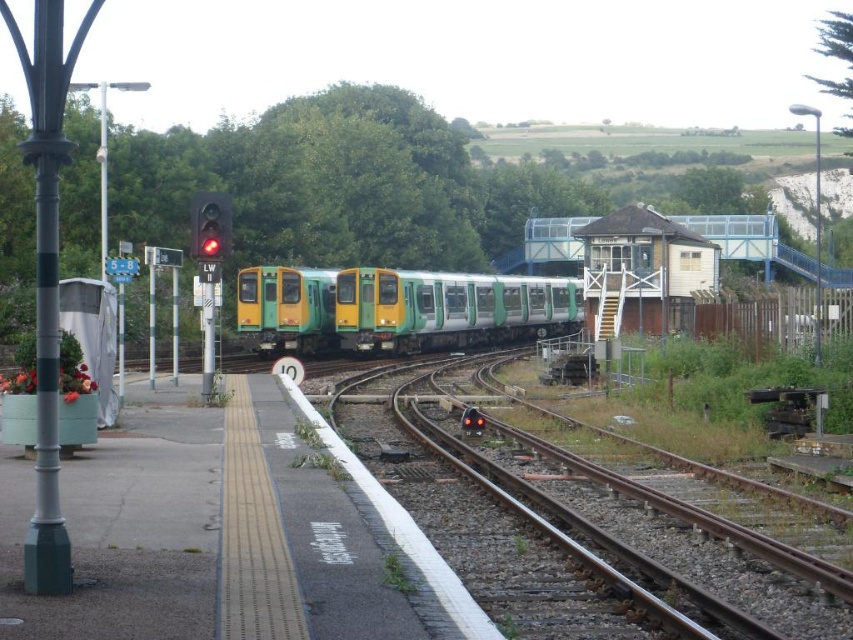
You are a pedestrian waiting on the platform and want to cross the tracks safely. You see the green metallic train at center and the red glass traffic light at center. Which object should you look towards to determine if it is safe to cross?

You should look towards the red glass traffic light at center to determine if it is safe to cross, as traffic lights typically indicate when it is safe to proceed.

You are a commuter at the railway station and need to determine which red glass traffic light is closer to you. You notice both the red glass traffic light at upper left and the red glass traffic light at center. Based on their sizes, which one is closer?

The red glass traffic light at upper left is bigger than the red glass traffic light at center, so it is closer to you because objects closer appear larger.

You are standing at the railway station platform and want to walk from the lamppost to the signal box. There are two points marked on the path. The first point is at coordinates point (207,234) and the second point is at point (463,429). Which point will you encounter first while walking towards the signal box?

You will encounter point (207,234) first because it is in front of point (463,429) along the path towards the signal box.